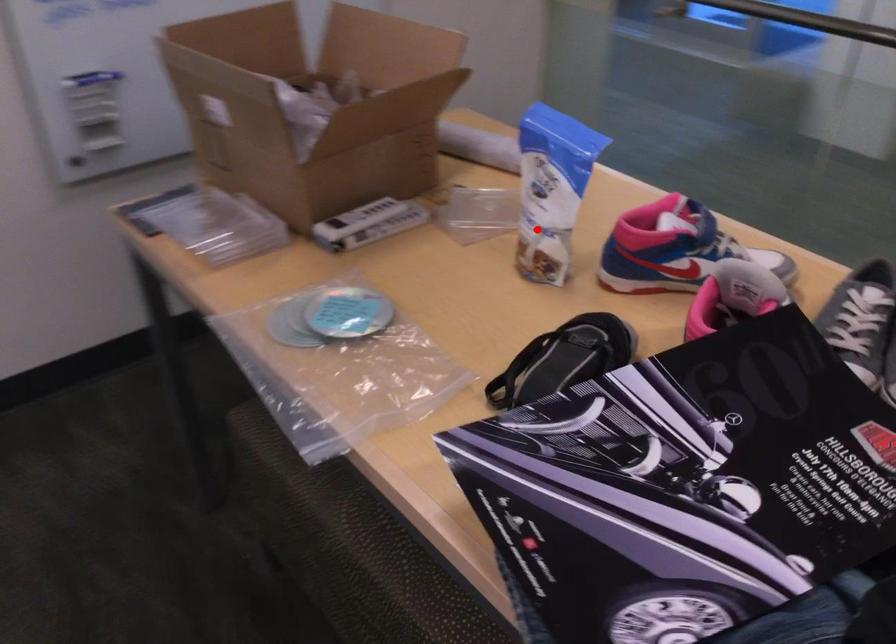
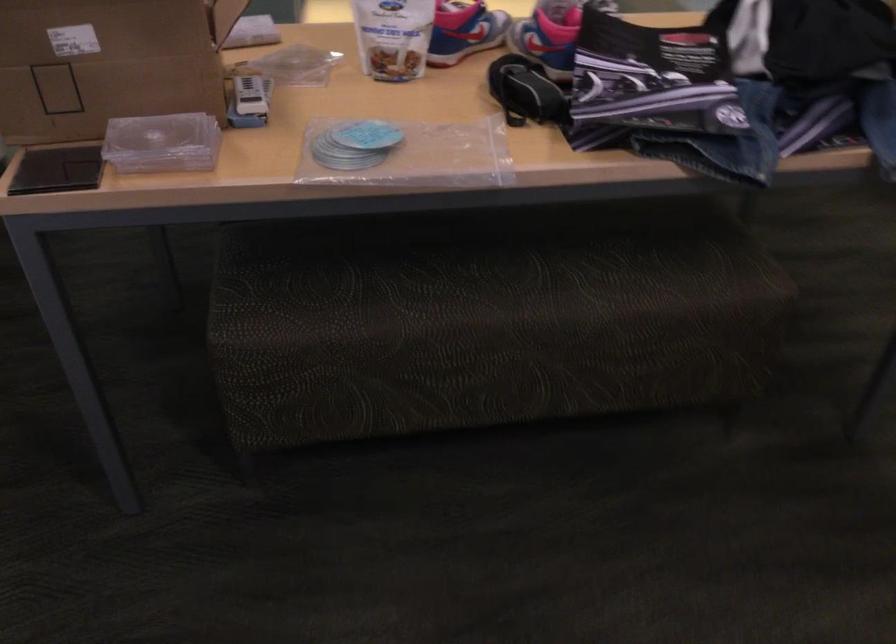
Question: I am providing you with two images of the same scene from different viewpoints. A red point is marked on the first image. Is the red point's position out of view in image 2?

Choices:
 (A) Yes
 (B) No

Answer: (B)